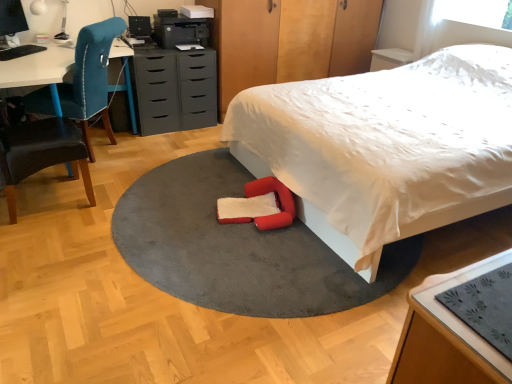
You are a GUI agent. You are given a task and a screenshot of the screen. Output one action in this format:
    pyautogui.click(x=<x>, y=<y>)
    Task: Click on the free location to the right of velvet teal chair at left, placed as the second chair when sorted from front to back
    
    Given the screenshot: What is the action you would take?
    pyautogui.click(x=162, y=159)